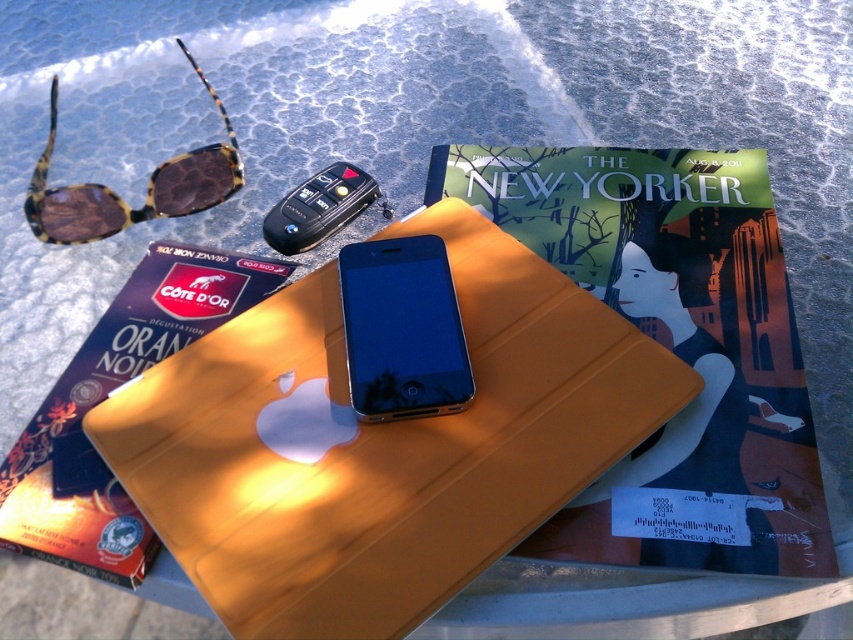
From the picture: You are trying to place a matte paper book at center and a black glossy smartphone at center on a shelf. Which object will require more space due to its size?

The matte paper book at center is bigger than the black glossy smartphone at center, so it will require more space.

You are organizing items on a table and want to place a new item between the matte paper book at center and the black glossy smartphone at center. Where should you position it so it sits between them?

To place an item between the matte paper book at center and the black glossy smartphone at center, position it below the matte paper book at center since it is above the smartphone.